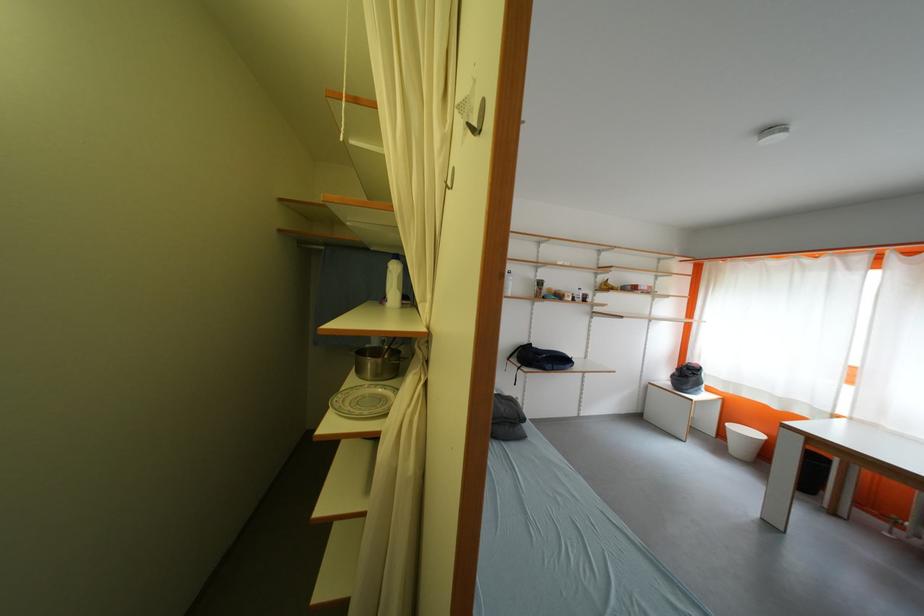
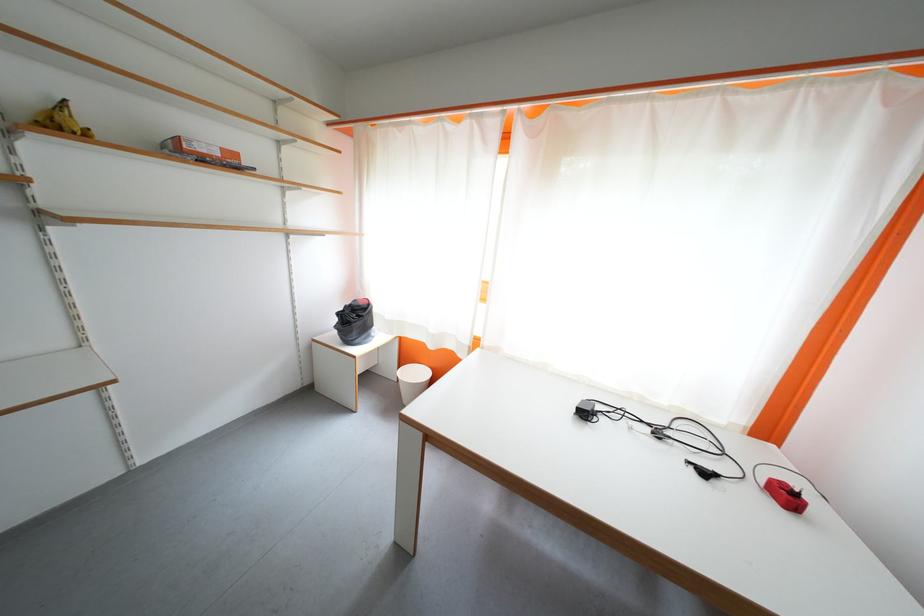
The point at (614, 290) is marked in the first image. Where is the corresponding point in the second image?

(68, 129)